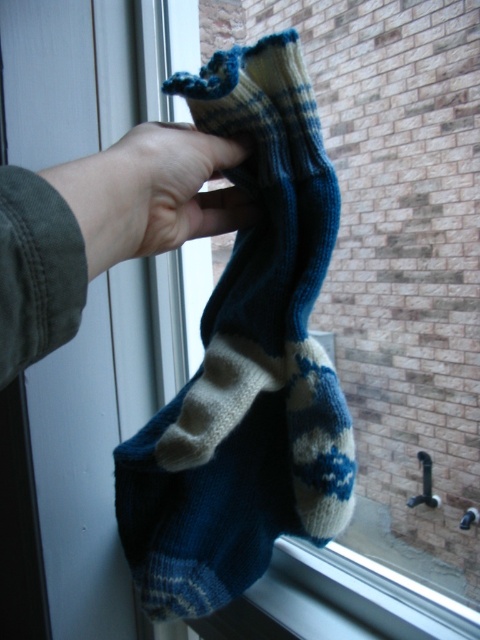
Who is higher up, blue knitted sock at upper center or skinny white hand at center?

skinny white hand at center is above.

Is blue knitted sock at upper center above skinny white hand at center?

Actually, blue knitted sock at upper center is below skinny white hand at center.

At what (x,y) coordinates should I click in order to perform the action: click on blue knitted sock at upper center. Please return your answer as a coordinate pair (x, y). The image size is (480, 640). Looking at the image, I should click on (247, 364).